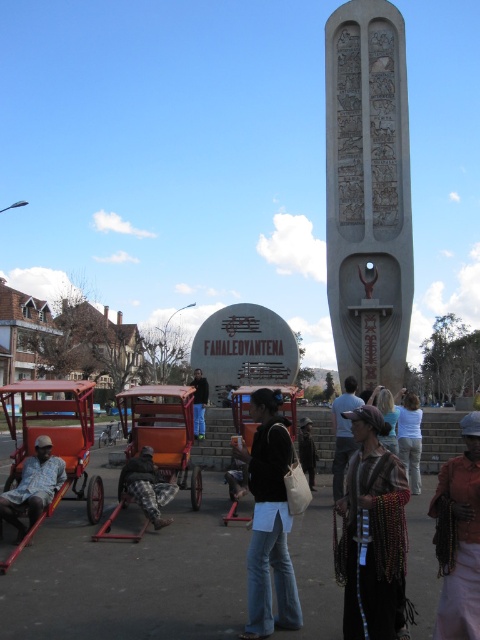
Is point (367, 172) positioned behind point (392, 456)?

Yes, it is.

From the picture: Is carved stone monument at center bigger than knitted woolen scarf at center?

Correct, carved stone monument at center is larger in size than knitted woolen scarf at center.

Does point (375, 154) lie in front of point (383, 516)?

That is False.

Find the location of a particular element. The width and height of the screenshot is (480, 640). carved stone monument at center is located at coordinates (368, 189).

Does point (62, 449) lie in front of point (474, 576)?

No, (62, 449) is further to viewer.

Is red wood wagon at left smaller than brown woven bag at lower right?

No, red wood wagon at left is not smaller than brown woven bag at lower right.

Who is more forward, (x=58, y=428) or (x=460, y=516)?

Point (x=460, y=516) is more forward.

This screenshot has height=640, width=480. In order to click on red wood wagon at left in this screenshot , I will do `click(56, 436)`.

Can you confirm if red wood wagon at left is positioned above white cotton shirt at center?

No.

Can you confirm if red wood wagon at left is shorter than white cotton shirt at center?

Incorrect, red wood wagon at left's height does not fall short of white cotton shirt at center's.

What do you see at coordinates (56, 436) in the screenshot? I see `red wood wagon at left` at bounding box center [56, 436].

In order to click on red wood wagon at left in this screenshot , I will do pos(56,436).